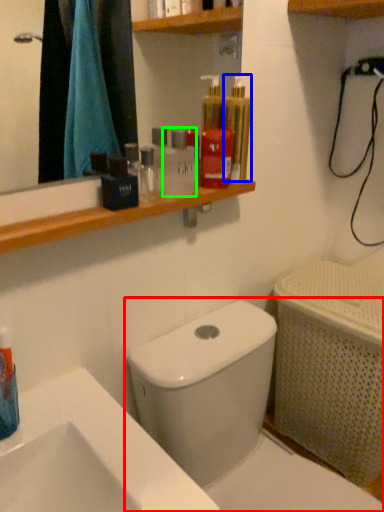
Question: Which object is the closest to the toilet (highlighted by a red box)? Choose among these: mouthwash (highlighted by a blue box) or mouthwash (highlighted by a green box).

Choices:
 (A) mouthwash
 (B) mouthwash

Answer: (B)